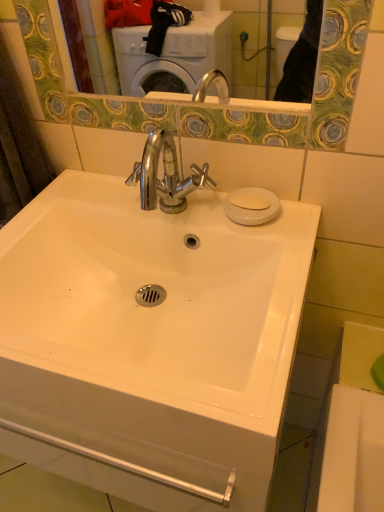
Question: Is white glossy sink at center smaller than white matte soap at upper right?

Choices:
 (A) yes
 (B) no

Answer: (B)

Question: From a real-world perspective, is white glossy sink at center physically below white matte soap at upper right?

Choices:
 (A) no
 (B) yes

Answer: (B)

Question: Is white glossy sink at center positioned beyond the bounds of white matte soap at upper right?

Choices:
 (A) yes
 (B) no

Answer: (A)

Question: Does white glossy sink at center appear on the right side of white matte soap at upper right?

Choices:
 (A) no
 (B) yes

Answer: (A)

Question: Is white glossy sink at center shorter than white matte soap at upper right?

Choices:
 (A) no
 (B) yes

Answer: (A)

Question: From a real-world perspective, is white glossy sink at center located higher than white matte soap at upper right?

Choices:
 (A) no
 (B) yes

Answer: (A)

Question: Would you say white matte soap at upper right is outside white glossy sink at center?

Choices:
 (A) yes
 (B) no

Answer: (A)

Question: Could you tell me if white matte soap at upper right is turned towards white glossy sink at center?

Choices:
 (A) yes
 (B) no

Answer: (B)

Question: Is white matte soap at upper right placed right next to white glossy sink at center?

Choices:
 (A) no
 (B) yes

Answer: (A)

Question: Is white matte soap at upper right surrounding white glossy sink at center?

Choices:
 (A) no
 (B) yes

Answer: (A)

Question: Does white matte soap at upper right come in front of white glossy sink at center?

Choices:
 (A) yes
 (B) no

Answer: (B)

Question: From the image's perspective, is white matte soap at upper right located beneath white glossy sink at center?

Choices:
 (A) yes
 (B) no

Answer: (B)

Question: From the image's perspective, is white matte soap at upper right positioned above or below white glossy sink at center?

Choices:
 (A) below
 (B) above

Answer: (B)